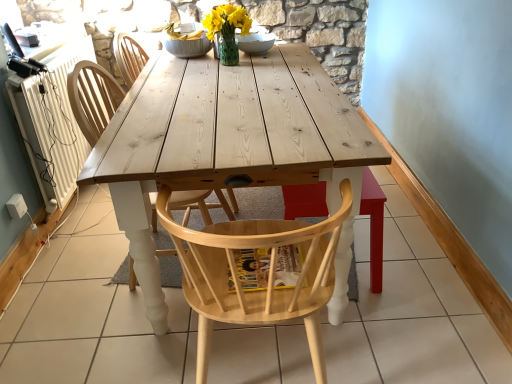
This screenshot has height=384, width=512. Describe the element at coordinates (256, 43) in the screenshot. I see `white ceramic bowl at center` at that location.

Identify the location of natural wood chair at center, the 3th chair viewed from the front. This screenshot has width=512, height=384. (126, 54).

From a real-world perspective, does natural wood chair at center, which ranks as the 3th chair in back-to-front order, stand above polka dot glass vase at center?

No.

Considering the relative sizes of natural wood chair at center, which ranks as the first chair in front-to-back order, and polka dot glass vase at center in the image provided, is natural wood chair at center, which ranks as the first chair in front-to-back order, shorter than polka dot glass vase at center?

Incorrect, the height of natural wood chair at center, which ranks as the first chair in front-to-back order, does not fall short of that of polka dot glass vase at center.

Between natural wood chair at center, which ranks as the 3th chair in back-to-front order, and polka dot glass vase at center, which one has larger size?

With larger size is natural wood chair at center, which ranks as the 3th chair in back-to-front order.

From a real-world perspective, which chair is the 3rd one underneath the polka dot glass vase at center? Please provide its 2D coordinates.

[(258, 273)]

Based on the photo, can you confirm if polka dot glass vase at center is positioned to the right of natural wood chair at center, which ranks as the 3th chair in back-to-front order?

No, polka dot glass vase at center is not to the right of natural wood chair at center, which ranks as the 3th chair in back-to-front order.

From the picture: How many degrees apart are the facing directions of polka dot glass vase at center and natural wood chair at center, which ranks as the first chair in front-to-back order?

The facing directions of polka dot glass vase at center and natural wood chair at center, which ranks as the first chair in front-to-back order, are 0.642 degrees apart.

Which is nearer, (214, 18) or (207, 288)?

The point (207, 288) is closer to the camera.

Are natural wood chair at center, which ranks as the first chair in front-to-back order, and natural wood chair at center, the 3th chair viewed from the front, far apart?

Absolutely, natural wood chair at center, which ranks as the first chair in front-to-back order, is distant from natural wood chair at center, the 3th chair viewed from the front.

Does point (266, 306) come farther from viewer compared to point (131, 64)?

No, it is not.

Does natural wood chair at center, which ranks as the 3th chair in back-to-front order, come in front of natural wood chair at center, the 1th chair when ordered from back to front?

Yes, it is.

Does natural wood chair at center, which ranks as the first chair in front-to-back order, turn towards natural wood chair at center, the 3th chair viewed from the front?

No, natural wood chair at center, which ranks as the first chair in front-to-back order, is not oriented towards natural wood chair at center, the 3th chair viewed from the front.

Can you confirm if polka dot glass vase at center is wider than natural wood chair at center, the 3th chair viewed from the front?

No, polka dot glass vase at center is not wider than natural wood chair at center, the 3th chair viewed from the front.

Considering the relative sizes of polka dot glass vase at center and natural wood chair at center, the 3th chair viewed from the front, in the image provided, is polka dot glass vase at center bigger than natural wood chair at center, the 3th chair viewed from the front,?

Actually, polka dot glass vase at center might be smaller than natural wood chair at center, the 3th chair viewed from the front.

Could you measure the distance between polka dot glass vase at center and natural wood chair at center, the 1th chair when ordered from back to front?

polka dot glass vase at center and natural wood chair at center, the 1th chair when ordered from back to front, are 21.91 inches apart from each other.

Would you say natural wood chair at center, the 1th chair when ordered from back to front, is part of polka dot glass vase at center's contents?

No, natural wood chair at center, the 1th chair when ordered from back to front, is not inside polka dot glass vase at center.

Considering the sizes of objects white ceramic bowl at center and natural wood chair at center, which ranks as the 3th chair in back-to-front order, in the image provided, who is smaller, white ceramic bowl at center or natural wood chair at center, which ranks as the 3th chair in back-to-front order,?

Smaller between the two is white ceramic bowl at center.

Does white ceramic bowl at center contain natural wood chair at center, which ranks as the 3th chair in back-to-front order?

No, natural wood chair at center, which ranks as the 3th chair in back-to-front order, is not inside white ceramic bowl at center.

Which is more to the right, white ceramic bowl at center or natural wood chair at center, which ranks as the first chair in front-to-back order?

natural wood chair at center, which ranks as the first chair in front-to-back order.

Is polka dot glass vase at center closer to camera compared to natural wood chair at center, the second chair when ordered from front to back?

No, polka dot glass vase at center is behind natural wood chair at center, the second chair when ordered from front to back.

Which is behind, point (211, 16) or point (90, 80)?

The point (211, 16) is more distant.

Could you measure the distance between polka dot glass vase at center and natural wood chair at center, the second chair when ordered from front to back?

polka dot glass vase at center and natural wood chair at center, the second chair when ordered from front to back, are 33.92 inches apart from each other.

Does polka dot glass vase at center touch natural wood chair at center, the 2th chair viewed from the back?

No, polka dot glass vase at center is not next to natural wood chair at center, the 2th chair viewed from the back.

In the scene shown: Does white ceramic bowl at center turn towards natural wood chair at center, the 3th chair viewed from the front?

No, white ceramic bowl at center is not turned towards natural wood chair at center, the 3th chair viewed from the front.

Are white ceramic bowl at center and natural wood chair at center, the 1th chair when ordered from back to front, located far from each other?

No, white ceramic bowl at center is in close proximity to natural wood chair at center, the 1th chair when ordered from back to front.

Can you tell me how much white ceramic bowl at center and natural wood chair at center, the 3th chair viewed from the front, differ in facing direction?

white ceramic bowl at center and natural wood chair at center, the 3th chair viewed from the front, are facing 90.4 degrees away from each other.

Is white ceramic bowl at center taller or shorter than natural wood chair at center, the 3th chair viewed from the front?

white ceramic bowl at center is shorter than natural wood chair at center, the 3th chair viewed from the front.

Where is `flower on the left of the natural wood chair at center, which ranks as the first chair in front-to-back order`? The width and height of the screenshot is (512, 384). flower on the left of the natural wood chair at center, which ranks as the first chair in front-to-back order is located at coordinates (226, 20).

Where is `flower that appears above the natural wood chair at center, which ranks as the first chair in front-to-back order (from a real-world perspective)`? The image size is (512, 384). flower that appears above the natural wood chair at center, which ranks as the first chair in front-to-back order (from a real-world perspective) is located at coordinates (226, 20).

Estimate the real-world distances between objects in this image. Which object is closer to natural wood chair at center, the second chair when ordered from front to back, white ceramic bowl at center or polka dot glass vase at center?

white ceramic bowl at center is positioned closer to the anchor natural wood chair at center, the second chair when ordered from front to back.

Considering their positions, is natural wood chair at center, which ranks as the 3th chair in back-to-front order, positioned further to natural wood chair at center, the 2th chair viewed from the back, than white ceramic bowl at center?

Based on the image, white ceramic bowl at center appears to be further to natural wood chair at center, the 2th chair viewed from the back.

Estimate the real-world distances between objects in this image. Which object is closer to natural wood chair at center, the second chair when ordered from front to back, natural wood chair at center, which ranks as the 3th chair in back-to-front order, or natural wood chair at center, the 3th chair viewed from the front?

natural wood chair at center, which ranks as the 3th chair in back-to-front order.

Based on their spatial positions, is natural wood chair at center, which ranks as the first chair in front-to-back order, or white ceramic bowl at center closer to natural wood chair at center, the 3th chair viewed from the front?

Based on the image, white ceramic bowl at center appears to be nearer to natural wood chair at center, the 3th chair viewed from the front.

Based on their spatial positions, is natural wood chair at center, the 2th chair viewed from the back, or natural wood chair at center, the 3th chair viewed from the front, further from polka dot glass vase at center?

Based on the image, natural wood chair at center, the 2th chair viewed from the back, appears to be further to polka dot glass vase at center.

Which object lies further to the anchor point natural wood chair at center, the 3th chair viewed from the front, polka dot glass vase at center or white ceramic bowl at center?

The object further to natural wood chair at center, the 3th chair viewed from the front, is white ceramic bowl at center.

From the image, which object appears to be farther from polka dot glass vase at center, white ceramic bowl at center or natural wood chair at center, which ranks as the first chair in front-to-back order?

natural wood chair at center, which ranks as the first chair in front-to-back order, is positioned further to the anchor polka dot glass vase at center.

Considering their positions, is natural wood chair at center, the 3th chair viewed from the front, positioned closer to white ceramic bowl at center than natural wood chair at center, the 2th chair viewed from the back?

Among the two, natural wood chair at center, the 3th chair viewed from the front, is located nearer to white ceramic bowl at center.

Where is `flower between natural wood chair at center, which ranks as the 3th chair in back-to-front order, and white ceramic bowl at center from front to back`? This screenshot has height=384, width=512. flower between natural wood chair at center, which ranks as the 3th chair in back-to-front order, and white ceramic bowl at center from front to back is located at coordinates (226, 20).

Image resolution: width=512 pixels, height=384 pixels. What are the coordinates of `flower between natural wood chair at center, the 2th chair viewed from the back, and white ceramic bowl at center in the front-back direction` in the screenshot? It's located at (226, 20).

Identify the location of flower between white ceramic bowl at center and natural wood chair at center, the 1th chair when ordered from back to front, vertically. The width and height of the screenshot is (512, 384). (226, 20).

Image resolution: width=512 pixels, height=384 pixels. Find the location of `chair positioned between natural wood chair at center, which ranks as the 3th chair in back-to-front order, and natural wood chair at center, the 3th chair viewed from the front, from near to far`. chair positioned between natural wood chair at center, which ranks as the 3th chair in back-to-front order, and natural wood chair at center, the 3th chair viewed from the front, from near to far is located at coordinates (93, 98).